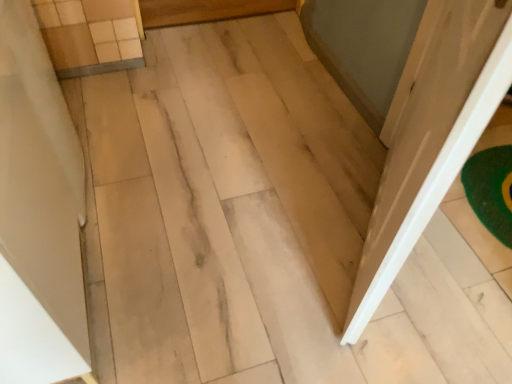
Locate an element on the screen. The height and width of the screenshot is (384, 512). white wood door at right is located at coordinates (431, 135).

Measure the distance between white wood door at right and camera.

18.15 inches.

In order to face white wood door at right, should I rotate leftwards or rightwards?

It's best to rotate right around 19.586 degrees.

The height and width of the screenshot is (384, 512). Describe the element at coordinates (431, 135) in the screenshot. I see `white wood door at right` at that location.

You are a GUI agent. You are given a task and a screenshot of the screen. Output one action in this format:
    pyautogui.click(x=<x>, y=<y>)
    Task: Click on the white wood door at right
    The width and height of the screenshot is (512, 384).
    Given the screenshot: What is the action you would take?
    pyautogui.click(x=431, y=135)